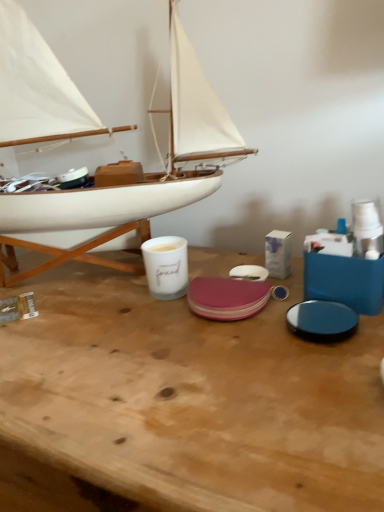
Question: Is wooden table at center aimed at white wood boat at left?

Choices:
 (A) yes
 (B) no

Answer: (B)

Question: From a real-world perspective, is wooden table at center positioned under white wood boat at left based on gravity?

Choices:
 (A) yes
 (B) no

Answer: (A)

Question: Considering the relative sizes of wooden table at center and white wood boat at left in the image provided, is wooden table at center shorter than white wood boat at left?

Choices:
 (A) no
 (B) yes

Answer: (B)

Question: Is wooden table at center at the left side of white wood boat at left?

Choices:
 (A) yes
 (B) no

Answer: (B)

Question: Does wooden table at center lie behind white wood boat at left?

Choices:
 (A) yes
 (B) no

Answer: (B)

Question: Is white ceramic mug at center spatially inside white wood boat at left, or outside of it?

Choices:
 (A) inside
 (B) outside

Answer: (A)

Question: Is white ceramic mug at center taller or shorter than white wood boat at left?

Choices:
 (A) short
 (B) tall

Answer: (A)

Question: From a real-world perspective, is white ceramic mug at center positioned above or below white wood boat at left?

Choices:
 (A) below
 (B) above

Answer: (A)

Question: Is point (178, 237) positioned closer to the camera than point (187, 61)?

Choices:
 (A) closer
 (B) farther

Answer: (B)

Question: Is wooden table at center in front of or behind white wood boat at left in the image?

Choices:
 (A) front
 (B) behind

Answer: (A)

Question: From a real-world perspective, is wooden table at center positioned above or below white wood boat at left?

Choices:
 (A) above
 (B) below

Answer: (B)

Question: Is point (180, 494) closer or farther from the camera than point (192, 50)?

Choices:
 (A) farther
 (B) closer

Answer: (B)

Question: Is wooden table at center to the left or to the right of white wood boat at left in the image?

Choices:
 (A) left
 (B) right

Answer: (B)

Question: Based on their positions, is white ceramic mug at center located to the left or right of wooden table at center?

Choices:
 (A) left
 (B) right

Answer: (B)

Question: Is point (183, 251) positioned closer to the camera than point (9, 431)?

Choices:
 (A) closer
 (B) farther

Answer: (B)